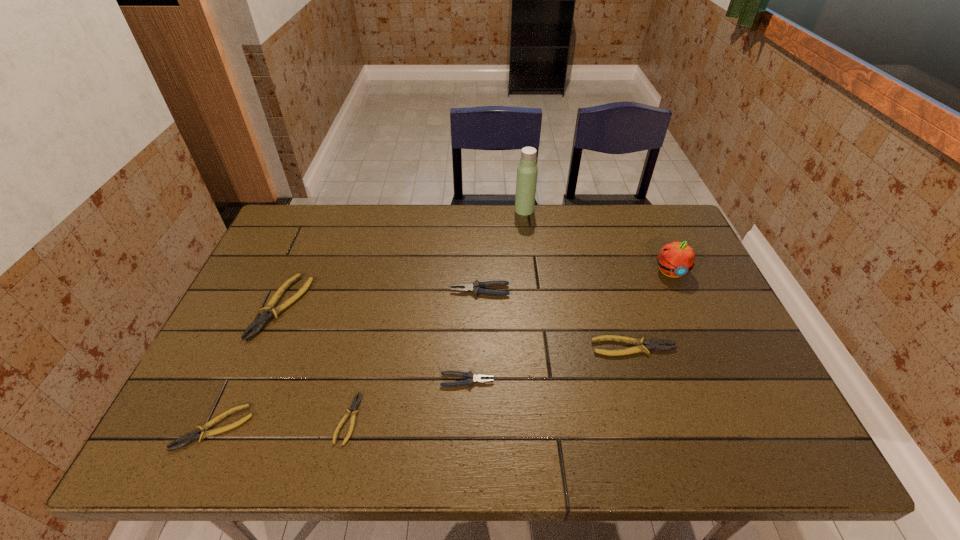
Locate an element on the screen. This screenshot has height=540, width=960. vacant area that satisfies the following two spatial constraints: 1. on the front side of the biggest yellow pliers; 2. on the right side of the smallest yellow pliers is located at coordinates (233, 419).